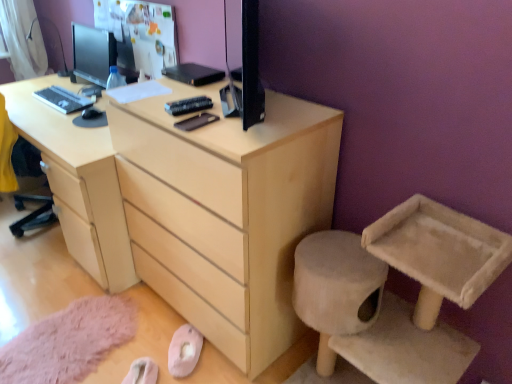
At what (x,y) coordinates should I click in order to perform the action: click on free space to the left of matte black keyboard at left. Please return your answer as a coordinate pair (x, y). The image size is (512, 384). Looking at the image, I should click on (23, 94).